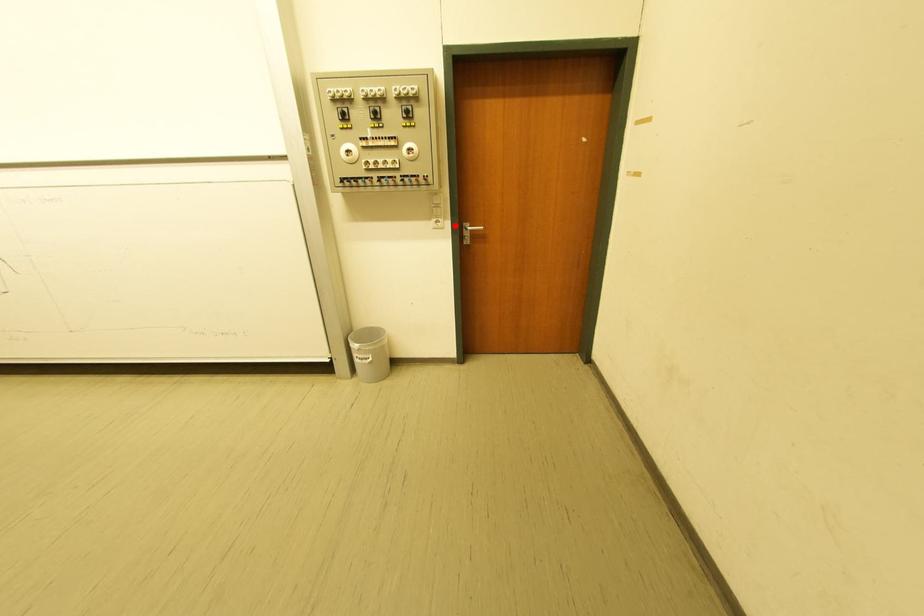
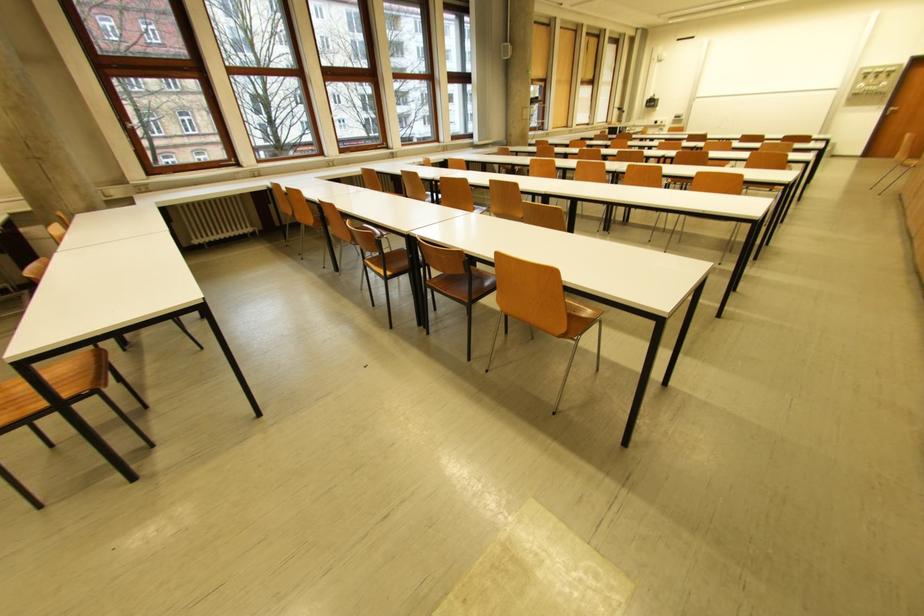
Question: I am providing you with two images of the same scene from different viewpoints. Given a red point in image1, look at the same physical point in image2. Is it:

Choices:
 (A) Closer to the viewpoint
 (B) Farther from the viewpoint

Answer: (B)